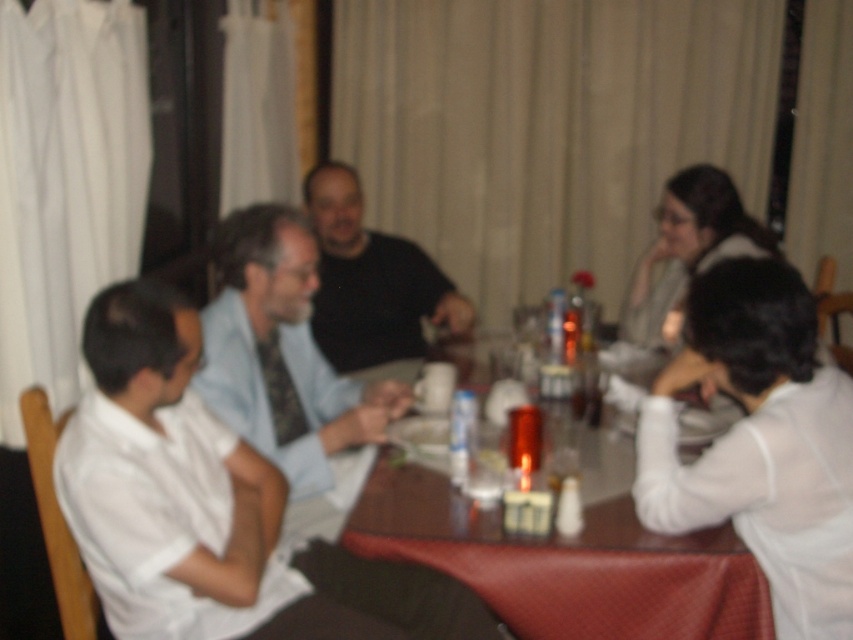
Question: Is white shirt at center to the right of smooth brown table at center from the viewer's perspective?

Choices:
 (A) no
 (B) yes

Answer: (A)

Question: Is white shirt at center positioned at the back of smooth brown table at center?

Choices:
 (A) yes
 (B) no

Answer: (B)

Question: Can you confirm if white shirt at center is positioned above blue textured shirt at center?

Choices:
 (A) no
 (B) yes

Answer: (A)

Question: Which object is positioned farthest from the smooth brown table at center?

Choices:
 (A) white shirt at center
 (B) blue textured shirt at center

Answer: (B)

Question: Which point is closer to the camera?

Choices:
 (A) black matte shirt at center
 (B) blue textured shirt at center
 (C) white shirt at center

Answer: (C)

Question: Which object is closer to the camera taking this photo?

Choices:
 (A) white shirt at center
 (B) black matte shirt at center
 (C) blue textured shirt at center

Answer: (A)